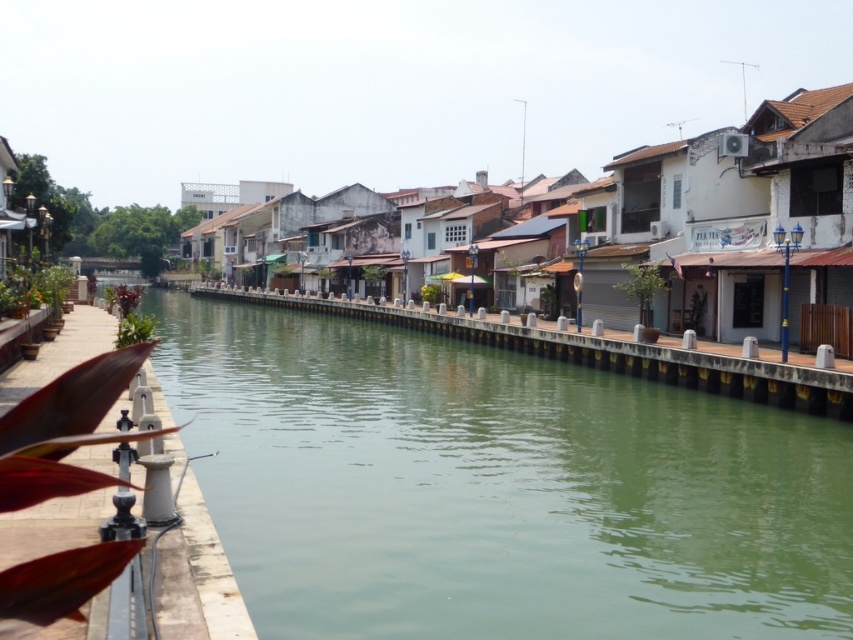
Question: Considering the real-world distances, which object is closest to the green smooth water at center?

Choices:
 (A) smooth concrete railing at center
 (B) white concrete dock at lower left

Answer: (A)

Question: Which of the following is the closest to the observer?

Choices:
 (A) white concrete dock at lower left
 (B) smooth concrete railing at center
 (C) green smooth water at center

Answer: (A)

Question: Can you confirm if green smooth water at center is bigger than smooth concrete railing at center?

Choices:
 (A) no
 (B) yes

Answer: (A)

Question: Can you confirm if green smooth water at center is wider than white concrete dock at lower left?

Choices:
 (A) yes
 (B) no

Answer: (A)

Question: Estimate the real-world distances between objects in this image. Which object is farther from the white concrete dock at lower left?

Choices:
 (A) smooth concrete railing at center
 (B) green smooth water at center

Answer: (A)

Question: Is green smooth water at center closer to the viewer compared to white concrete dock at lower left?

Choices:
 (A) yes
 (B) no

Answer: (B)